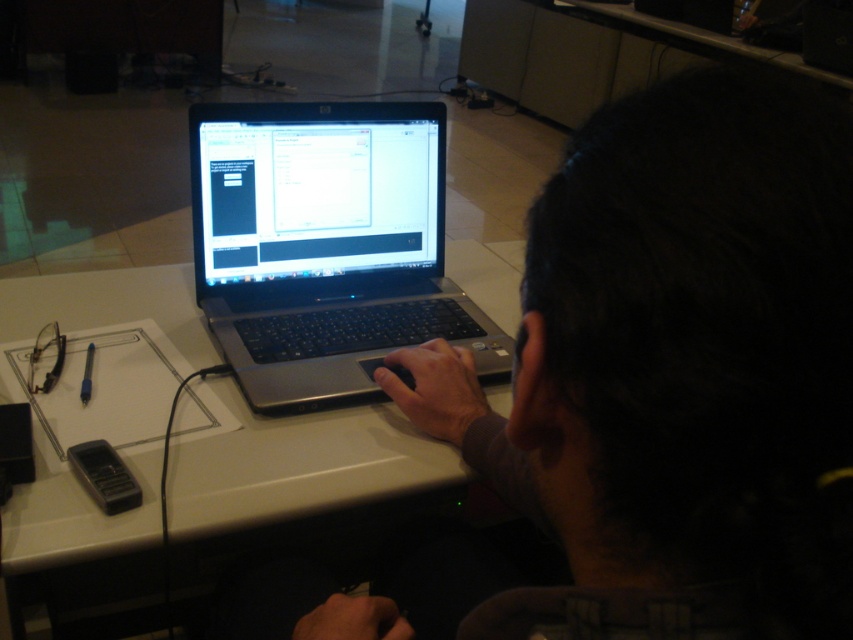
Which is more to the right, silver/black plastic laptop at center or black plastic phone at lower left?

silver/black plastic laptop at center is more to the right.

Is silver/black plastic laptop at center shorter than black plastic phone at lower left?

Incorrect, silver/black plastic laptop at center's height does not fall short of black plastic phone at lower left's.

Does point (361, 150) lie in front of point (99, 467)?

No, it is not.

The image size is (853, 640). Identify the location of silver/black plastic laptop at center. (323, 244).

Does white glossy table at center appear on the right side of black plastic phone at lower left?

Correct, you'll find white glossy table at center to the right of black plastic phone at lower left.

What do you see at coordinates (297, 465) in the screenshot? Image resolution: width=853 pixels, height=640 pixels. I see `white glossy table at center` at bounding box center [297, 465].

Locate an element on the screen. white glossy table at center is located at coordinates (297, 465).

Locate an element on the screen. Image resolution: width=853 pixels, height=640 pixels. dark matte laptop at center is located at coordinates (677, 369).

Does point (656, 372) come farther from viewer compared to point (364, 419)?

No, it is not.

Where is `dark matte laptop at center`? The height and width of the screenshot is (640, 853). dark matte laptop at center is located at coordinates (677, 369).

Identify the location of dark matte laptop at center. (677, 369).